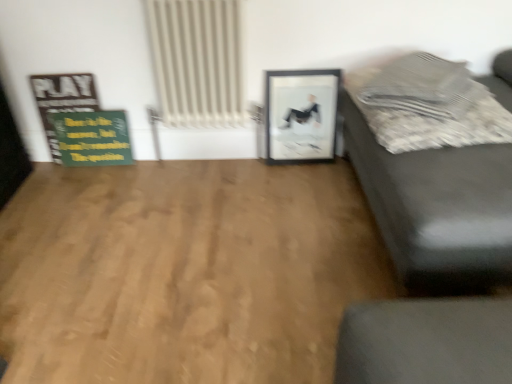
Measure the distance between white textured radiator at upper center and camera.

A distance of 1.70 meters exists between white textured radiator at upper center and camera.

What is the approximate width of wooden signboard at left?

The width of wooden signboard at left is 2.69 inches.

Measure the distance between wooden signboard at left and camera.

wooden signboard at left and camera are 6.38 feet apart from each other.

Where is `black matte picture frame at center`? black matte picture frame at center is located at coordinates (301, 115).

The width and height of the screenshot is (512, 384). In order to click on white textured radiator at upper center in this screenshot , I will do `click(197, 61)`.

Where is `hardwood below the black matte picture frame at center (from a real-world perspective)`? hardwood below the black matte picture frame at center (from a real-world perspective) is located at coordinates (184, 272).

Does natural wood floor at center have a lesser height compared to black matte picture frame at center?

Indeed, natural wood floor at center has a lesser height compared to black matte picture frame at center.

Are natural wood floor at center and black matte picture frame at center located far from each other?

That's not correct — natural wood floor at center is a little close to black matte picture frame at center.

Who is smaller, textured gray pillow at upper right or wooden signboard at left?

With smaller size is wooden signboard at left.

From the image's perspective, between textured gray pillow at upper right and wooden signboard at left, which one is located above?

textured gray pillow at upper right, from the image's perspective.

Based on their positions, is textured gray pillow at upper right located to the left or right of wooden signboard at left?

From the image, it's evident that textured gray pillow at upper right is to the right of wooden signboard at left.

Looking at this image, from a real-world perspective, is textured gray pillow at upper right physically above wooden signboard at left?

Yes, from a real-world perspective, textured gray pillow at upper right is on top of wooden signboard at left.

Is natural wood floor at center surrounded by textured gray pillow at upper right?

No, natural wood floor at center is not a part of textured gray pillow at upper right.

Between textured gray pillow at upper right and natural wood floor at center, which one has smaller size?

textured gray pillow at upper right.

Considering the relative sizes of textured gray pillow at upper right and natural wood floor at center in the image provided, is textured gray pillow at upper right shorter than natural wood floor at center?

No, textured gray pillow at upper right is not shorter than natural wood floor at center.

Considering the positions of point (461, 102) and point (322, 193), is point (461, 102) closer or farther from the camera than point (322, 193)?

Point (461, 102) appears to be closer to the viewer than point (322, 193).

Choose the correct answer: Is textured gray pillow at upper right inside black matte picture frame at center or outside it?

textured gray pillow at upper right lies outside black matte picture frame at center.

From a real-world perspective, which object stands above the other?

textured gray pillow at upper right.

Can you confirm if textured gray pillow at upper right is positioned to the left of black matte picture frame at center?

No, textured gray pillow at upper right is not to the left of black matte picture frame at center.

Is textured gray pillow at upper right looking in the opposite direction of black matte picture frame at center?

No, black matte picture frame at center is not at the back of textured gray pillow at upper right.

From the picture: Who is shorter, white textured radiator at upper center or wooden signboard at left?

wooden signboard at left.

Which object is positioned more to the left, white textured radiator at upper center or wooden signboard at left?

Positioned to the left is wooden signboard at left.

Which point is more forward, (198, 89) or (93, 98)?

The point (198, 89) is closer to the camera.

Looking at their sizes, would you say white textured radiator at upper center is wider or thinner than natural wood floor at center?

Considering their sizes, white textured radiator at upper center looks slimmer than natural wood floor at center.

Relative to natural wood floor at center, is white textured radiator at upper center in front or behind?

Visually, white textured radiator at upper center is located behind natural wood floor at center.

From the picture: From a real-world perspective, which is physically below, white textured radiator at upper center or natural wood floor at center?

natural wood floor at center is physically lower.

Can you confirm if white textured radiator at upper center is bigger than natural wood floor at center?

Actually, white textured radiator at upper center might be smaller than natural wood floor at center.

Does textured gray pillow at upper right turn towards matte black couch at right?

Yes, textured gray pillow at upper right faces towards matte black couch at right.

From the image's perspective, is textured gray pillow at upper right above matte black couch at right?

Yes, from the image's perspective, textured gray pillow at upper right is above matte black couch at right.

Between textured gray pillow at upper right and matte black couch at right, which one has larger size?

matte black couch at right is bigger.

Which object is further away from the camera taking this photo, textured gray pillow at upper right or matte black couch at right?

textured gray pillow at upper right is more distant.

What are the coordinates of `picture frame on the right of natural wood floor at center` in the screenshot? It's located at (301, 115).

The height and width of the screenshot is (384, 512). What are the coordinates of `bulletin board below the textured gray pillow at upper right (from the image's perspective)` in the screenshot? It's located at (62, 100).

When comparing their distances from white textured radiator at upper center, does wooden signboard at left or matte black couch at right seem further?

The object further to white textured radiator at upper center is matte black couch at right.

From the image, which object appears to be farther from black matte picture frame at center, matte black couch at right or natural wood floor at center?

matte black couch at right lies further to black matte picture frame at center than the other object.

Estimate the real-world distances between objects in this image. Which object is closer to wooden signboard at left, black matte picture frame at center or white textured radiator at upper center?

The object closer to wooden signboard at left is white textured radiator at upper center.

From the image, which object appears to be nearer to black matte picture frame at center, wooden signboard at left or natural wood floor at center?

natural wood floor at center.

Based on their spatial positions, is natural wood floor at center or black matte picture frame at center further from white textured radiator at upper center?

natural wood floor at center lies further to white textured radiator at upper center than the other object.

When comparing their distances from wooden signboard at left, does natural wood floor at center or white textured radiator at upper center seem closer?

white textured radiator at upper center lies closer to wooden signboard at left than the other object.

Looking at this image, from the image, which object appears to be nearer to white textured radiator at upper center, textured gray pillow at upper right or black matte picture frame at center?

black matte picture frame at center lies closer to white textured radiator at upper center than the other object.

Which object lies nearer to the anchor point white textured radiator at upper center, wooden signboard at left or textured gray pillow at upper right?

The object closer to white textured radiator at upper center is wooden signboard at left.

Identify the location of picture frame situated between natural wood floor at center and textured gray pillow at upper right from left to right. The height and width of the screenshot is (384, 512). (301, 115).

Locate an element on the screen. This screenshot has height=384, width=512. radiator situated between wooden signboard at left and textured gray pillow at upper right from left to right is located at coordinates (197, 61).

This screenshot has height=384, width=512. Identify the location of radiator between natural wood floor at center and matte black couch at right in the horizontal direction. (197, 61).

Where is `radiator situated between natural wood floor at center and textured gray pillow at upper right from left to right`? This screenshot has height=384, width=512. radiator situated between natural wood floor at center and textured gray pillow at upper right from left to right is located at coordinates (197, 61).